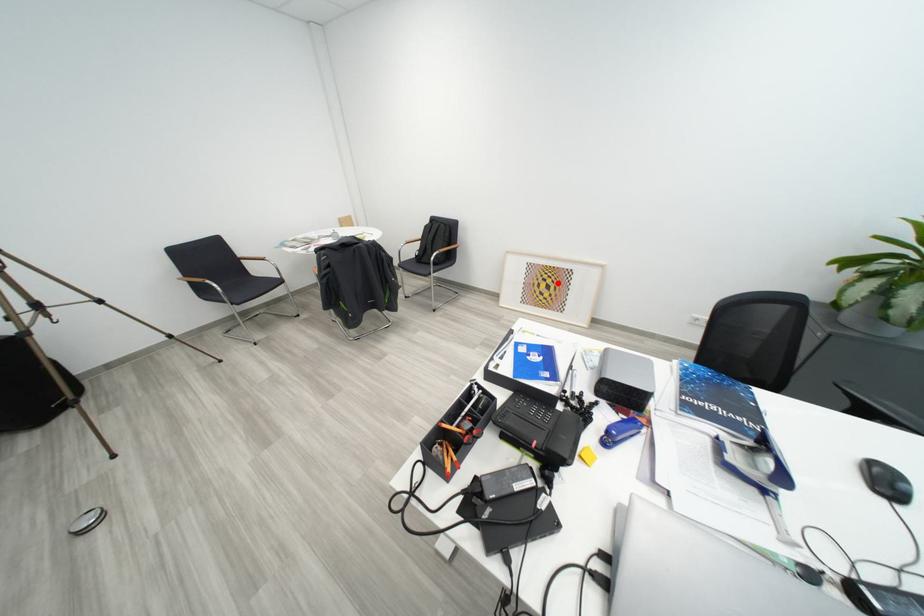
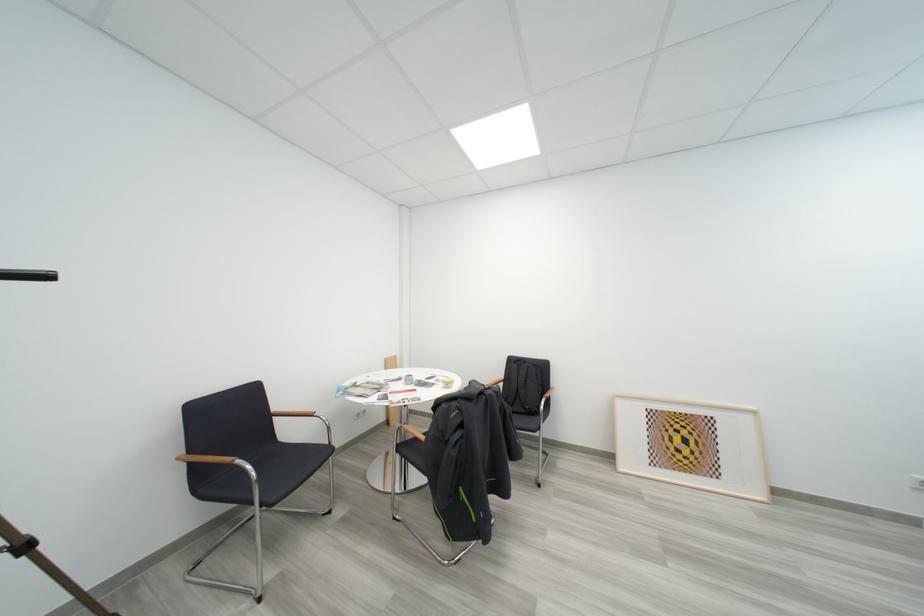
In the second image, find the point that corresponds to the highlighted location in the first image.

(693, 435)